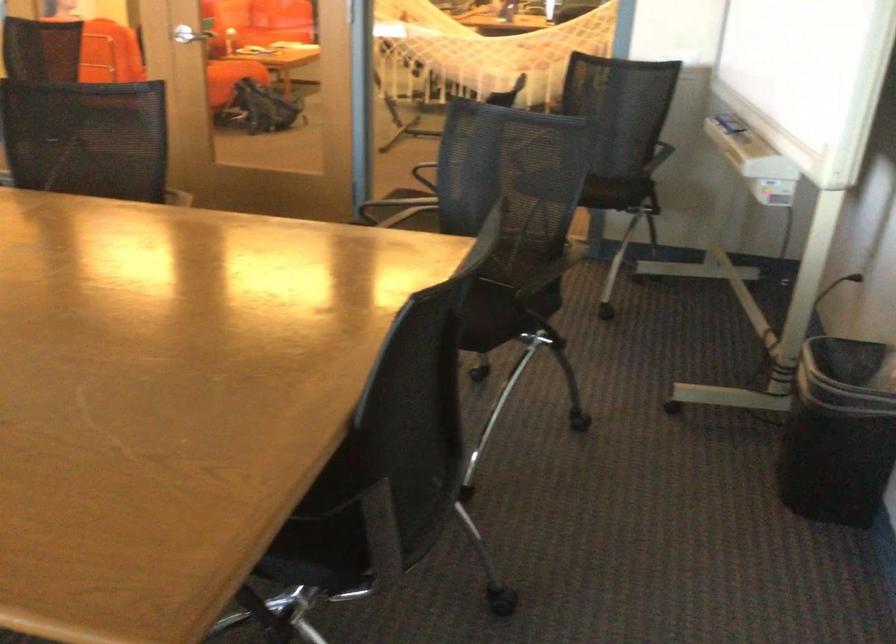
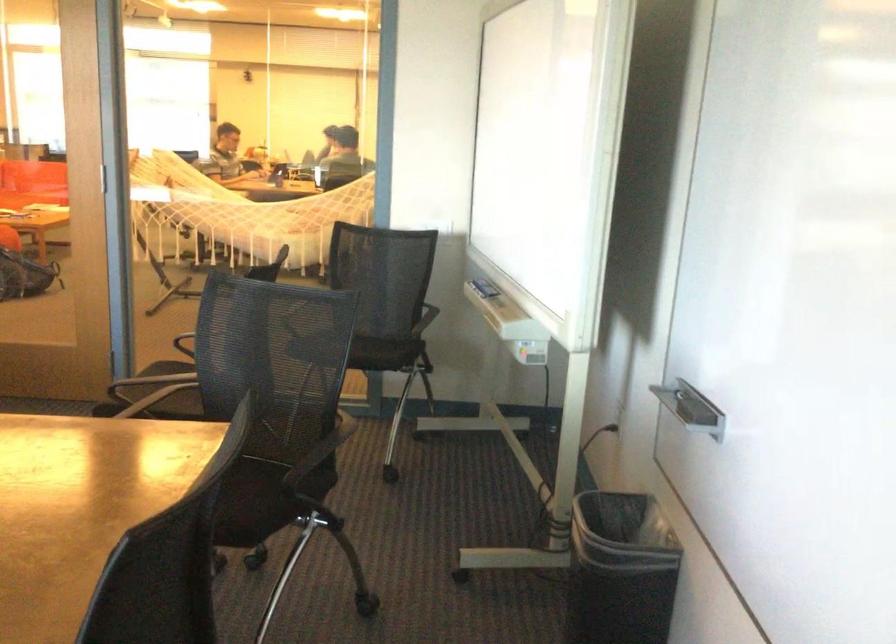
The images are taken continuously from a first-person perspective. In which direction are you moving?

The cameraman moved toward right, forward.